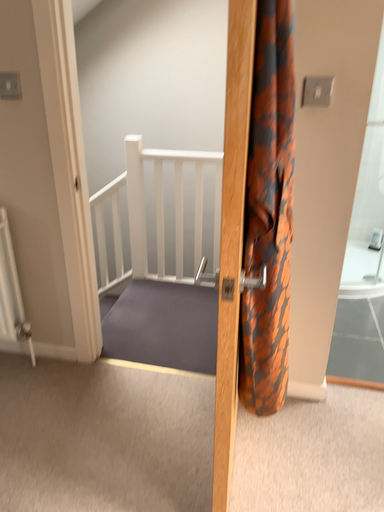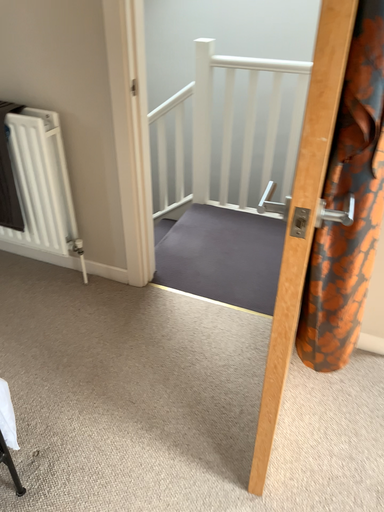
Question: Which way did the camera rotate in the video?

Choices:
 (A) rotated upward
 (B) rotated downward

Answer: (B)